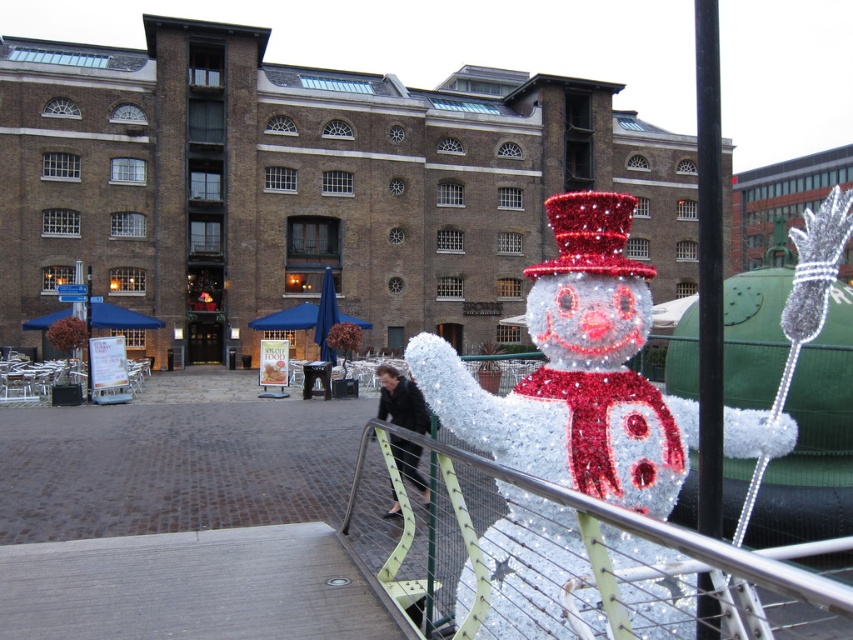
Question: Is black metal pole at right below shiny red sequined hat at center?

Choices:
 (A) yes
 (B) no

Answer: (A)

Question: Observing the image, what is the correct spatial positioning of iridescent plastic snowman at center in reference to shiny red sequined hat at center?

Choices:
 (A) left
 (B) right

Answer: (A)

Question: Which of the following is the farthest from the observer?

Choices:
 (A) metallic silver fence at lower right
 (B) shiny red sequined hat at center

Answer: (B)

Question: In this image, where is metallic silver fence at lower right located relative to shiny red sequined hat at center?

Choices:
 (A) right
 (B) left

Answer: (B)

Question: Estimate the real-world distances between objects in this image. Which object is closer to the shiny red sequined hat at center?

Choices:
 (A) metallic silver fence at lower right
 (B) black metal pole at right

Answer: (A)

Question: Among these points, which one is nearest to the camera?

Choices:
 (A) (596, 234)
 (B) (720, 275)

Answer: (B)